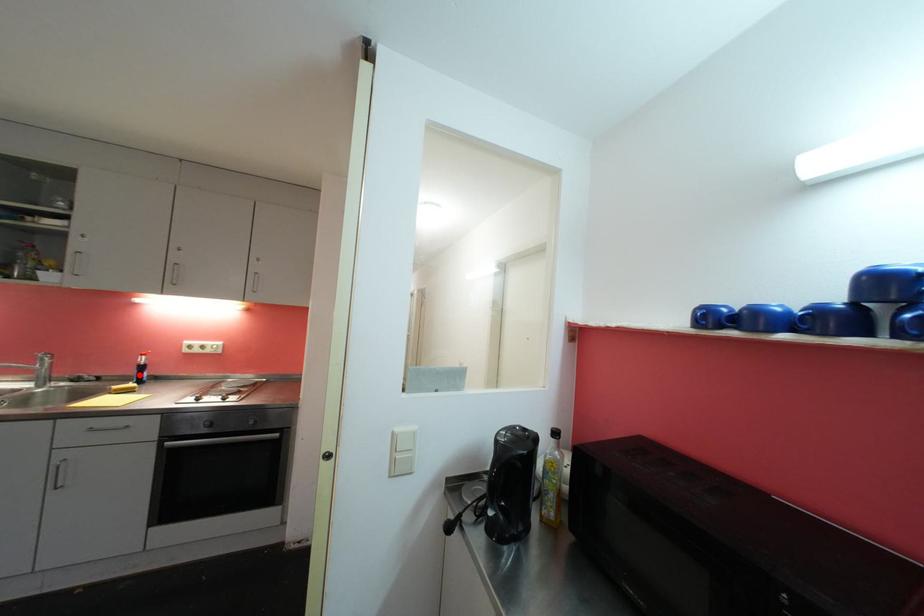
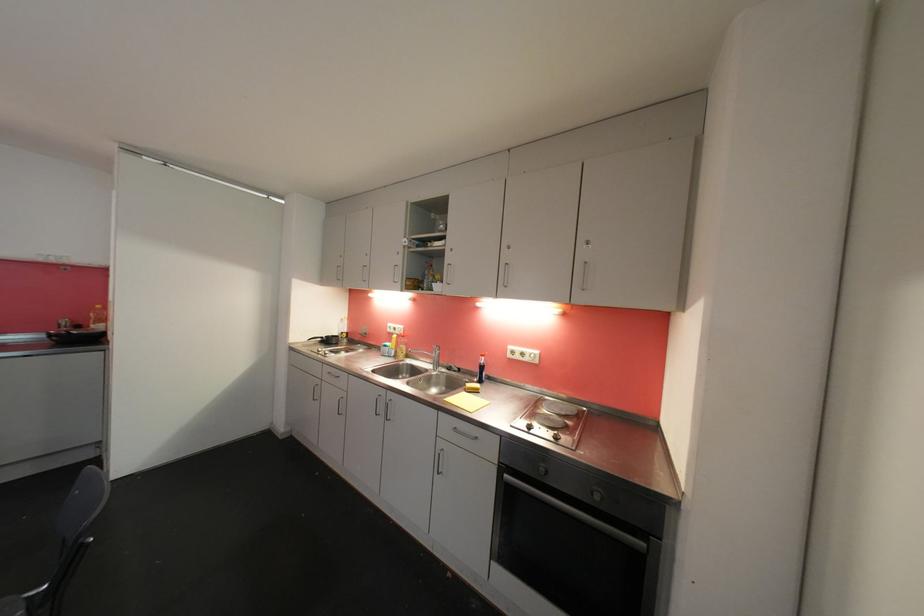
In the second image, find the point that corresponds to the highlighted location in the first image.

(482, 373)